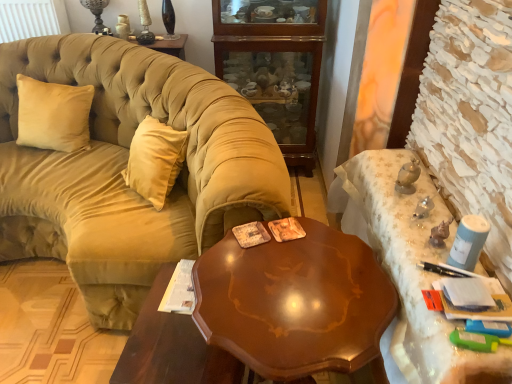
Question: From the image's perspective, is glossy wood table at center over velvet beige couch at left?

Choices:
 (A) yes
 (B) no

Answer: (B)

Question: Is glossy wood table at center wider than velvet beige couch at left?

Choices:
 (A) yes
 (B) no

Answer: (B)

Question: Does glossy wood table at center appear on the right side of velvet beige couch at left?

Choices:
 (A) yes
 (B) no

Answer: (A)

Question: Is glossy wood table at center aimed at velvet beige couch at left?

Choices:
 (A) yes
 (B) no

Answer: (B)

Question: Is glossy wood table at center thinner than velvet beige couch at left?

Choices:
 (A) no
 (B) yes

Answer: (B)

Question: Considering the relative positions of beige velvet pillow at left and shiny brown wood table at center, which appears as the 2th desk when viewed from the right, in the image provided, is beige velvet pillow at left to the left or to the right of shiny brown wood table at center, which appears as the 2th desk when viewed from the right,?

Choices:
 (A) left
 (B) right

Answer: (A)

Question: Is beige velvet pillow at left in front of or behind shiny brown wood table at center, which appears as the 2th desk when viewed from the right, in the image?

Choices:
 (A) behind
 (B) front

Answer: (A)

Question: Is beige velvet pillow at left situated inside shiny brown wood table at center, which ranks as the 1th desk in left-to-right order, or outside?

Choices:
 (A) outside
 (B) inside

Answer: (A)

Question: From a real-world perspective, is beige velvet pillow at left physically located above or below shiny brown wood table at center, which appears as the 2th desk when viewed from the right?

Choices:
 (A) below
 (B) above

Answer: (B)

Question: Relative to white lace tablecloth at right, which is the 1th desk from right to left, is velvet beige couch at left in front or behind?

Choices:
 (A) front
 (B) behind

Answer: (B)

Question: Is velvet beige couch at left situated inside white lace tablecloth at right, which is the 1th desk from right to left, or outside?

Choices:
 (A) outside
 (B) inside

Answer: (A)

Question: Is velvet beige couch at left wider or thinner than white lace tablecloth at right, which is the 1th desk from right to left?

Choices:
 (A) wide
 (B) thin

Answer: (A)

Question: From a real-world perspective, is velvet beige couch at left physically located above or below white lace tablecloth at right, which is the 1th desk from right to left?

Choices:
 (A) below
 (B) above

Answer: (B)

Question: Considering the positions of point (257, 337) and point (92, 251), is point (257, 337) closer or farther from the camera than point (92, 251)?

Choices:
 (A) farther
 (B) closer

Answer: (B)

Question: In terms of size, does shiny brown wood table at center, which appears as the 2th desk when viewed from the right, appear bigger or smaller than velvet beige couch at left?

Choices:
 (A) small
 (B) big

Answer: (A)